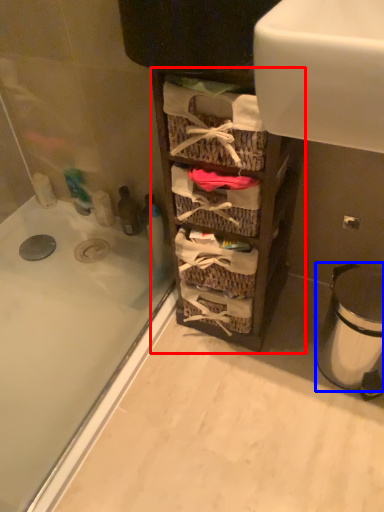
Question: Among these objects, which one is nearest to the camera, cabinetry (highlighted by a red box) or trash bin/can (highlighted by a blue box)?

Choices:
 (A) cabinetry
 (B) trash bin/can

Answer: (A)